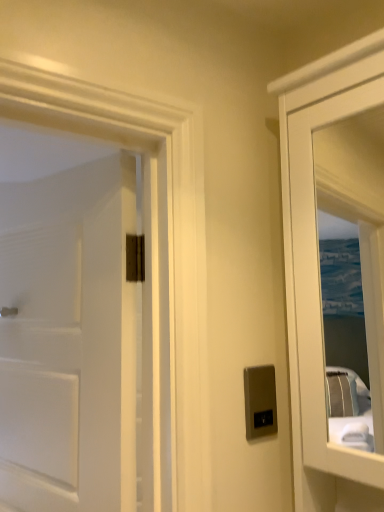
Question: Does satin silver switch at center have a smaller size compared to white matte door at left?

Choices:
 (A) yes
 (B) no

Answer: (A)

Question: Is satin silver switch at center at the right side of white matte door at left?

Choices:
 (A) yes
 (B) no

Answer: (A)

Question: Does satin silver switch at center have a greater height compared to white matte door at left?

Choices:
 (A) no
 (B) yes

Answer: (A)

Question: From the image's perspective, is satin silver switch at center located above white matte door at left?

Choices:
 (A) no
 (B) yes

Answer: (A)

Question: Is satin silver switch at center behind white matte door at left?

Choices:
 (A) no
 (B) yes

Answer: (B)

Question: Is satin silver switch at center wider than white matte door at left?

Choices:
 (A) no
 (B) yes

Answer: (A)

Question: Does white matte door at left lie behind satin silver switch at center?

Choices:
 (A) yes
 (B) no

Answer: (B)

Question: Could you tell me if white matte door at left is turned towards satin silver switch at center?

Choices:
 (A) no
 (B) yes

Answer: (A)

Question: Is white matte door at left outside satin silver switch at center?

Choices:
 (A) no
 (B) yes

Answer: (B)

Question: Considering the relative sizes of white matte door at left and satin silver switch at center in the image provided, is white matte door at left bigger than satin silver switch at center?

Choices:
 (A) no
 (B) yes

Answer: (B)

Question: Is white matte door at left taller than satin silver switch at center?

Choices:
 (A) no
 (B) yes

Answer: (B)

Question: Considering the relative sizes of white matte door at left and satin silver switch at center in the image provided, is white matte door at left smaller than satin silver switch at center?

Choices:
 (A) yes
 (B) no

Answer: (B)

Question: Do you think white matte door at left is within satin silver switch at center, or outside of it?

Choices:
 (A) outside
 (B) inside

Answer: (A)